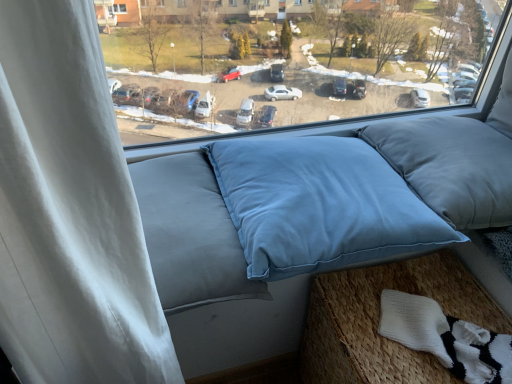
Question: Should I look upward or downward to see light blue fabric cushion at lower right?

Choices:
 (A) up
 (B) down

Answer: (B)

Question: Is blue fabric pillow at center, the first pillow from the left, behind satin blue pillow at center, acting as the 1th pillow starting from the right?

Choices:
 (A) yes
 (B) no

Answer: (B)

Question: Can you confirm if blue fabric pillow at center, the first pillow from the left, is smaller than satin blue pillow at center, the second pillow when ordered from left to right?

Choices:
 (A) no
 (B) yes

Answer: (A)

Question: Does blue fabric pillow at center, the first pillow from the left, have a lesser width compared to satin blue pillow at center, the second pillow when ordered from left to right?

Choices:
 (A) yes
 (B) no

Answer: (B)

Question: From the image's perspective, is blue fabric pillow at center, the first pillow from the left, on top of satin blue pillow at center, acting as the 1th pillow starting from the right?

Choices:
 (A) yes
 (B) no

Answer: (B)

Question: Are blue fabric pillow at center, which appears as the 2th pillow when viewed from the right, and satin blue pillow at center, the second pillow when ordered from left to right, located far from each other?

Choices:
 (A) no
 (B) yes

Answer: (A)

Question: Is blue fabric pillow at center, which appears as the 2th pillow when viewed from the right, next to satin blue pillow at center, acting as the 1th pillow starting from the right, and touching it?

Choices:
 (A) yes
 (B) no

Answer: (B)

Question: Does blue fabric pillow at center, the first pillow from the left, have a larger size compared to light blue fabric cushion at lower right?

Choices:
 (A) no
 (B) yes

Answer: (A)

Question: Does blue fabric pillow at center, which appears as the 2th pillow when viewed from the right, contain light blue fabric cushion at lower right?

Choices:
 (A) no
 (B) yes

Answer: (A)

Question: Is blue fabric pillow at center, which appears as the 2th pillow when viewed from the right, outside light blue fabric cushion at lower right?

Choices:
 (A) no
 (B) yes

Answer: (B)

Question: Is blue fabric pillow at center, the first pillow from the left, in contact with light blue fabric cushion at lower right?

Choices:
 (A) no
 (B) yes

Answer: (A)

Question: From a real-world perspective, is blue fabric pillow at center, which appears as the 2th pillow when viewed from the right, positioned under light blue fabric cushion at lower right based on gravity?

Choices:
 (A) no
 (B) yes

Answer: (A)

Question: Is blue fabric pillow at center, which appears as the 2th pillow when viewed from the right, positioned behind light blue fabric cushion at lower right?

Choices:
 (A) yes
 (B) no

Answer: (B)

Question: Is light blue fabric cushion at lower right outside of white knitted socks at lower right?

Choices:
 (A) no
 (B) yes

Answer: (B)